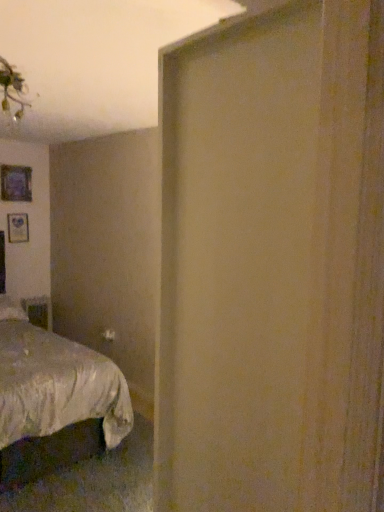
Question: Is point (13, 182) positioned closer to the camera than point (51, 401)?

Choices:
 (A) farther
 (B) closer

Answer: (A)

Question: Considering the positions of matte purple picture frame at upper left and silky white bed at lower left in the image, is matte purple picture frame at upper left wider or thinner than silky white bed at lower left?

Choices:
 (A) thin
 (B) wide

Answer: (A)

Question: Would you say matte purple picture frame at upper left is inside or outside silky white bed at lower left?

Choices:
 (A) inside
 (B) outside

Answer: (B)

Question: In terms of width, does silky white bed at lower left look wider or thinner when compared to matte purple picture frame at upper left?

Choices:
 (A) wide
 (B) thin

Answer: (A)

Question: Would you say silky white bed at lower left is inside or outside matte purple picture frame at upper left?

Choices:
 (A) outside
 (B) inside

Answer: (A)

Question: Is point (23, 355) positioned closer to the camera than point (4, 199)?

Choices:
 (A) closer
 (B) farther

Answer: (A)

Question: In the image, is silky white bed at lower left positioned in front of or behind matte purple picture frame at upper left?

Choices:
 (A) behind
 (B) front

Answer: (B)